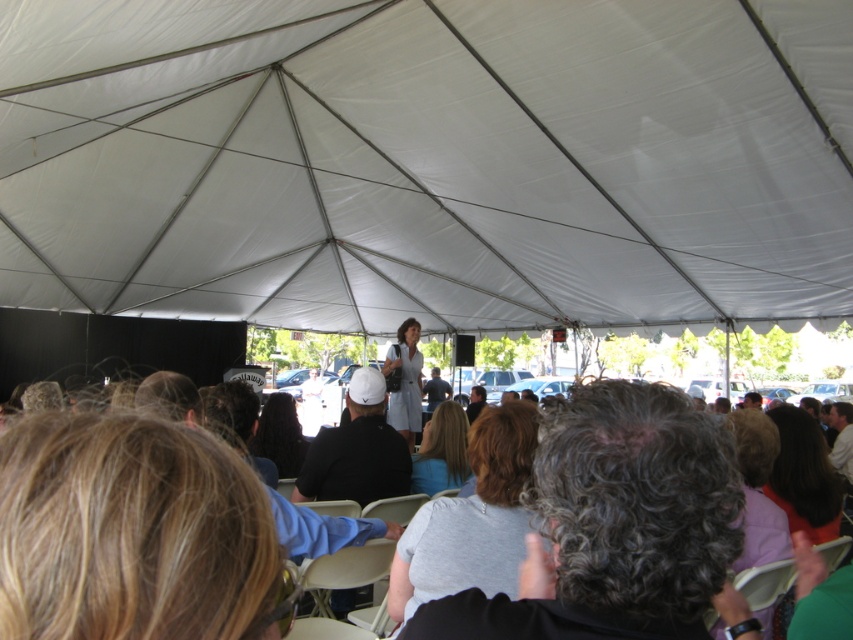
Which of these two, white fabric canopy at center or matte gray dress at center, stands shorter?

Standing shorter between the two is matte gray dress at center.

In the scene shown: Does white fabric canopy at center come in front of matte gray dress at center?

Yes, it is.

Does point (28, 220) come farther from viewer compared to point (416, 429)?

Yes, it is.

Identify the location of white fabric canopy at center. This screenshot has height=640, width=853. (428, 161).

Measure the distance from white fabric canopy at center to gray fabric chairs at center.

The distance of white fabric canopy at center from gray fabric chairs at center is 5.45 meters.

Does white fabric canopy at center appear on the left side of gray fabric chairs at center?

Indeed, white fabric canopy at center is positioned on the left side of gray fabric chairs at center.

Image resolution: width=853 pixels, height=640 pixels. In order to click on white fabric canopy at center in this screenshot , I will do `click(428, 161)`.

Is gray fabric chairs at center below white matte baseball cap at center?

No, gray fabric chairs at center is not below white matte baseball cap at center.

What do you see at coordinates (131, 532) in the screenshot?
I see `gray fabric chairs at center` at bounding box center [131, 532].

What are the coordinates of `gray fabric chairs at center` in the screenshot? It's located at tap(131, 532).